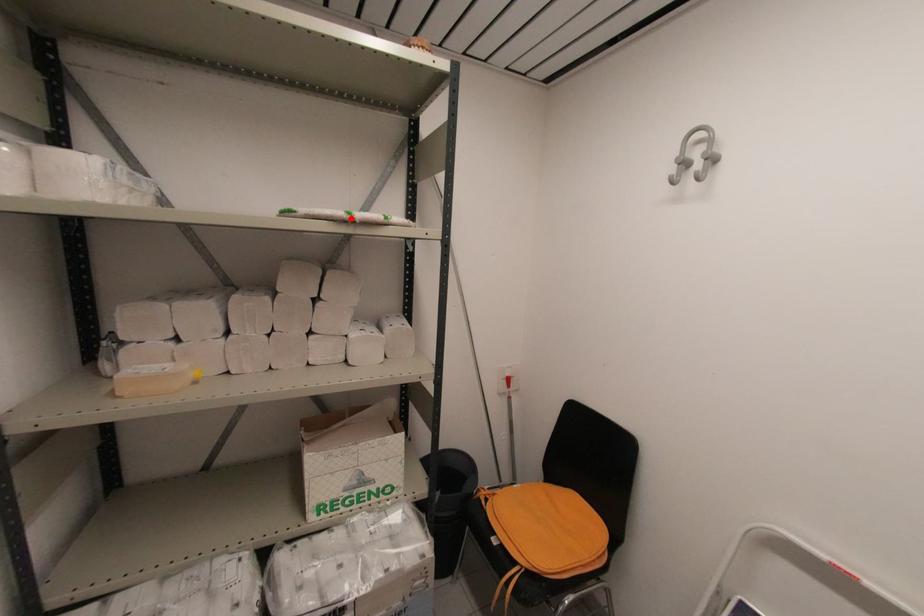
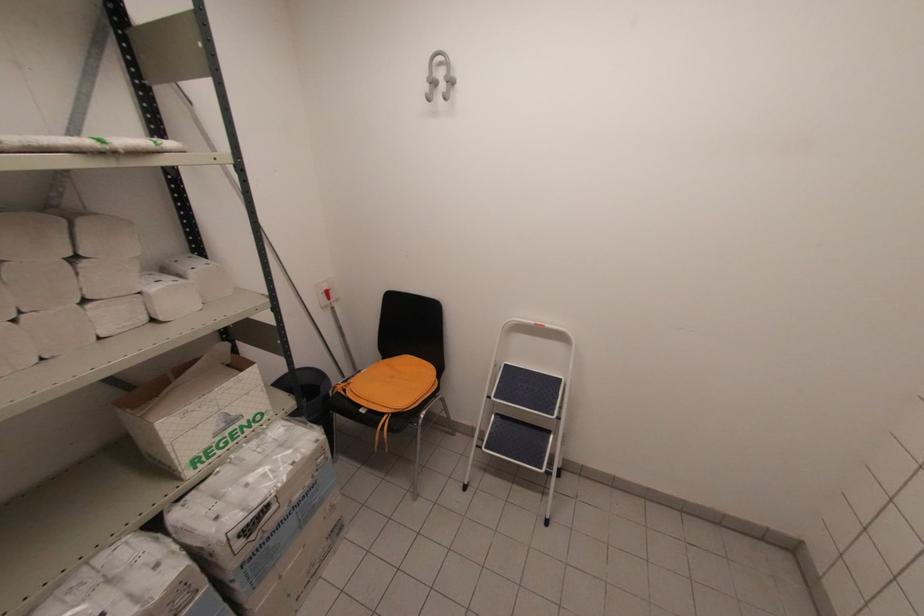
Find the pixel in the second image that matches the highlighted location in the first image.

(107, 148)